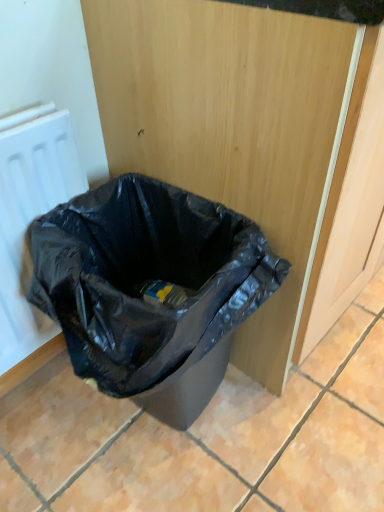
This screenshot has height=512, width=384. Identify the location of free location in front of white matte radiator at left. (49, 453).